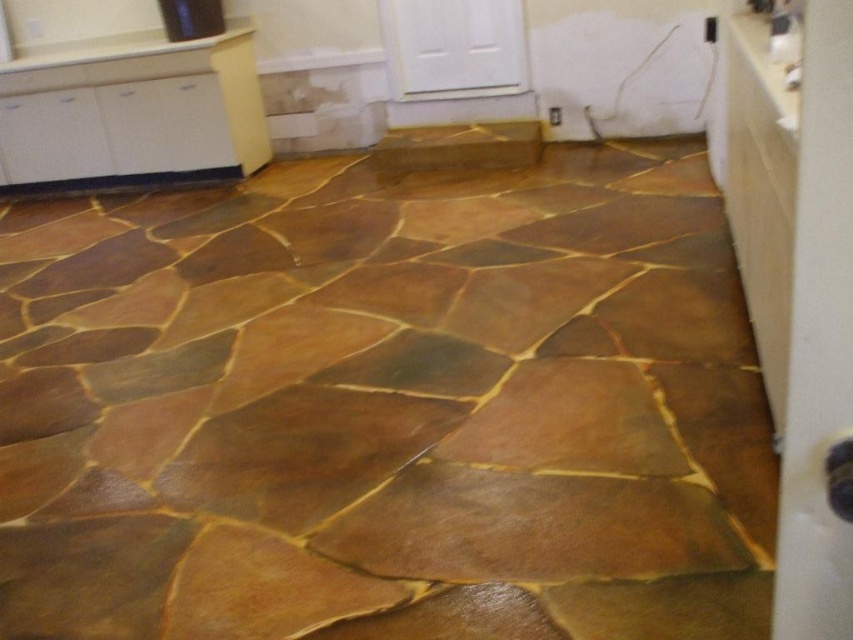
Question: Which point is farther to the camera?

Choices:
 (A) pyautogui.click(x=750, y=58)
 (B) pyautogui.click(x=306, y=308)
 (C) pyautogui.click(x=161, y=49)

Answer: (C)

Question: Which point is closer to the camera?

Choices:
 (A) white glossy counter top at upper left
 (B) white glossy counter top at upper right
 (C) brown polished stone at center

Answer: (B)

Question: Is brown polished stone at center bigger than white glossy counter top at upper right?

Choices:
 (A) no
 (B) yes

Answer: (B)

Question: Is white glossy counter top at upper right below white glossy counter top at upper left?

Choices:
 (A) no
 (B) yes

Answer: (B)

Question: Does brown polished stone at center have a larger size compared to white glossy counter top at upper right?

Choices:
 (A) yes
 (B) no

Answer: (A)

Question: Which object appears farthest from the camera in this image?

Choices:
 (A) white glossy counter top at upper right
 (B) brown polished stone at center

Answer: (B)